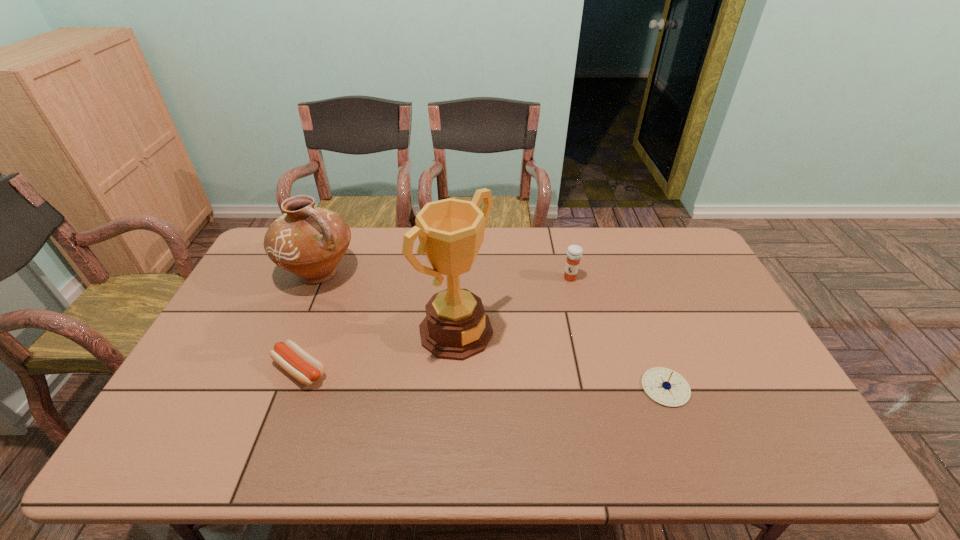
The image size is (960, 540). I want to click on vacant region between the award and the fourth shortest object, so click(x=388, y=302).

Locate an element on the screen. The height and width of the screenshot is (540, 960). vacant region between the medicine and the third object from right to left is located at coordinates tap(513, 305).

The width and height of the screenshot is (960, 540). I want to click on vacant point located between the fourth object from left to right and the compass, so click(x=618, y=333).

The width and height of the screenshot is (960, 540). What are the coordinates of `the third closest object to the medicine` in the screenshot? It's located at (308, 241).

Identify which object is located as the nearest to the rightmost object. Please provide its 2D coordinates. Your answer should be formatted as a tuple, i.e. [(x, y)], where the tuple contains the x and y coordinates of a point satisfying the conditions above.

[(574, 253)]

Find the location of a particular element. vacant space that satisfies the following two spatial constraints: 1. on the back side of the award; 2. on the right side of the shortest object is located at coordinates (314, 332).